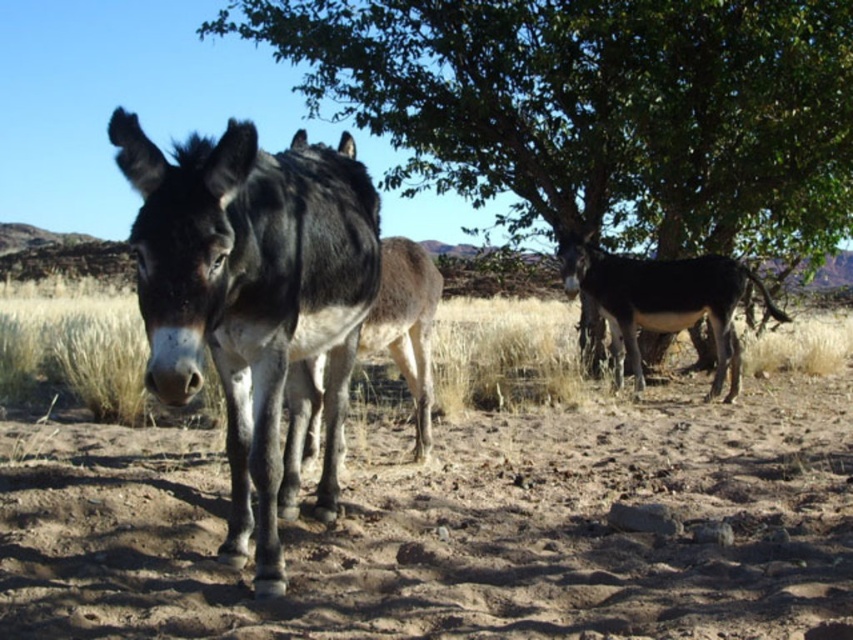
At what (x,y) coordinates should I click in order to perform the action: click on brown sandy dirt at center. Please return your answer as a coordinate pair (x, y). The image size is (853, 640). Looking at the image, I should click on (460, 524).

The image size is (853, 640). I want to click on brown sandy dirt at center, so click(460, 524).

Who is higher up, green leafy tree at center or dark brown glossy mule at right?

Positioned higher is green leafy tree at center.

Image resolution: width=853 pixels, height=640 pixels. What do you see at coordinates (595, 109) in the screenshot?
I see `green leafy tree at center` at bounding box center [595, 109].

Find the location of `green leafy tree at center`. green leafy tree at center is located at coordinates (595, 109).

Locate an element on the screen. green leafy tree at center is located at coordinates (595, 109).

Does dark gray fur mule at center have a larger size compared to dark brown glossy mule at right?

Actually, dark gray fur mule at center might be smaller than dark brown glossy mule at right.

Between dark gray fur mule at center and dark brown glossy mule at right, which one appears on the right side from the viewer's perspective?

Positioned to the right is dark brown glossy mule at right.

The image size is (853, 640). Describe the element at coordinates (253, 300) in the screenshot. I see `dark gray fur mule at center` at that location.

Where is `dark gray fur mule at center`? dark gray fur mule at center is located at coordinates (253, 300).